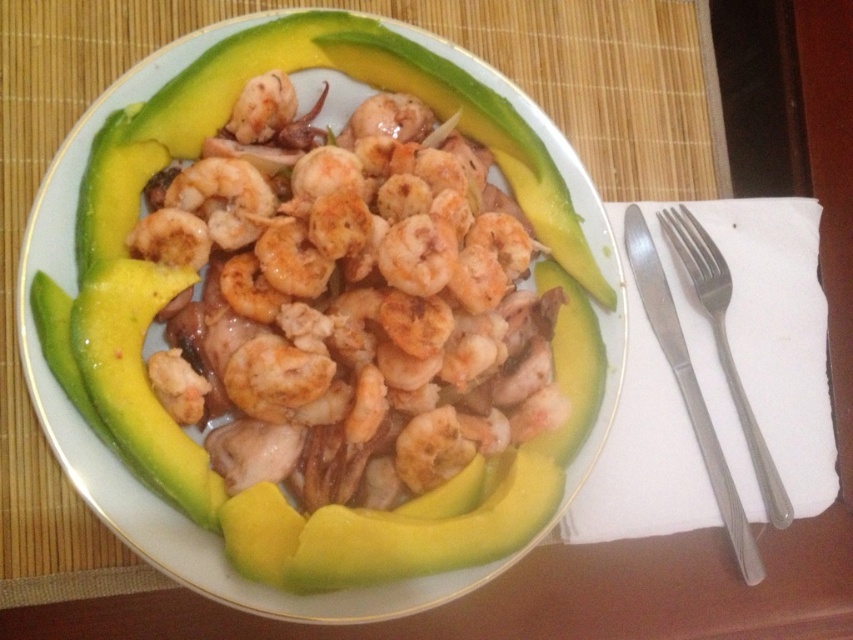
The image size is (853, 640). Describe the element at coordinates (170, 506) in the screenshot. I see `shiny white plate at center` at that location.

Does shiny white plate at center have a lesser width compared to satin silver fork at upper right?

In fact, shiny white plate at center might be wider than satin silver fork at upper right.

Locate an element on the screen. shiny white plate at center is located at coordinates (170, 506).